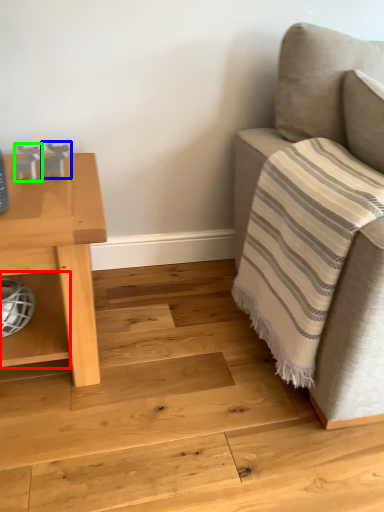
Question: Which object is positioned closest to shelf (highlighted by a red box)? Select from toy (highlighted by a blue box) and toy (highlighted by a green box).

Choices:
 (A) toy
 (B) toy

Answer: (B)